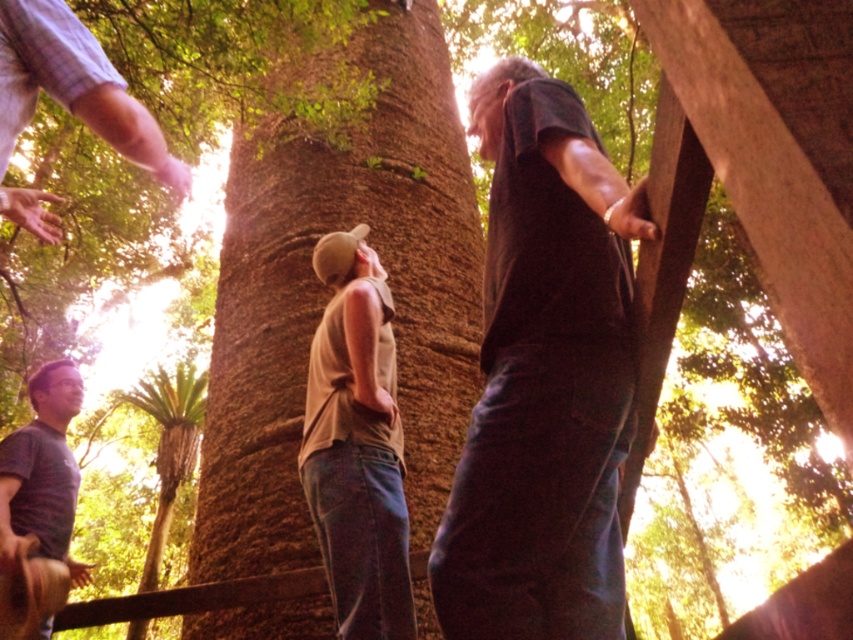
From the picture: You are a photographer trying to capture a clear shot of the dark gray shirt at upper right and the striped cotton shirt at lower left. Since you want both shirts to be in focus, which one should you focus on first?

The dark gray shirt at upper right is positioned over striped cotton shirt at lower left, so you should focus on the dark gray shirt at upper right first as it is closer to the camera.

You are a photographer trying to capture a group photo of the dark gray shirt at upper right and the tan fabric shirt at center. Since you want to ensure both subjects are clearly visible, which one should you focus on first to account for their sizes?

The dark gray shirt at upper right is larger in size than the tan fabric shirt at center, so you should focus on the dark gray shirt at upper right first to ensure its details are sharp before adjusting for the smaller subject.

You are a photographer trying to capture a group photo of the dark gray shirt at upper right and the tan fabric shirt at center. The camera you are using has a minimum focusing distance of 30 inches. Will you be able to take the photo without moving either person?

The dark gray shirt at upper right is 32.26 inches away from the tan fabric shirt at center. Since the minimum focusing distance is 30 inches, the camera can focus on both subjects as the distance between them is within the required range.